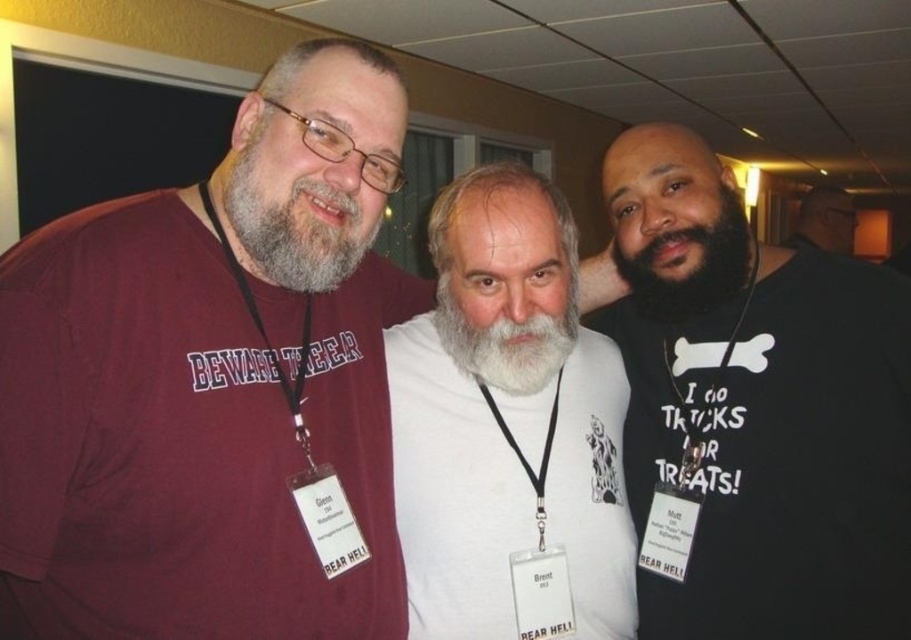
You are a photographer trying to capture a group photo of the graysoftbeard at left and the black matte shirt at center. If you want to make sure both subjects are in focus, which one should you adjust the camera focus on first?

Since graysoftbeard at left is smaller in size compared to black matte shirt at center, you should focus on the graysoftbeard at left first to ensure proper depth of field for both subjects.